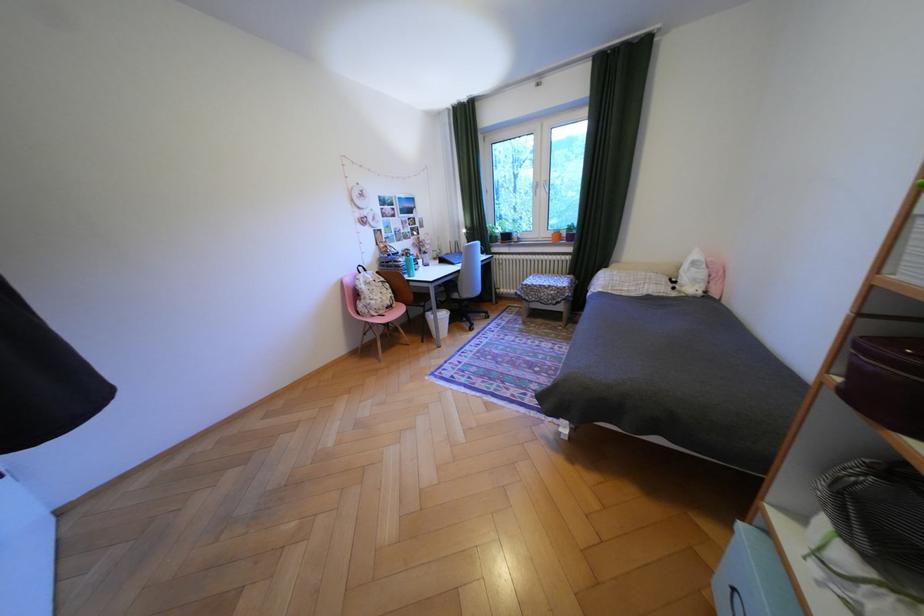
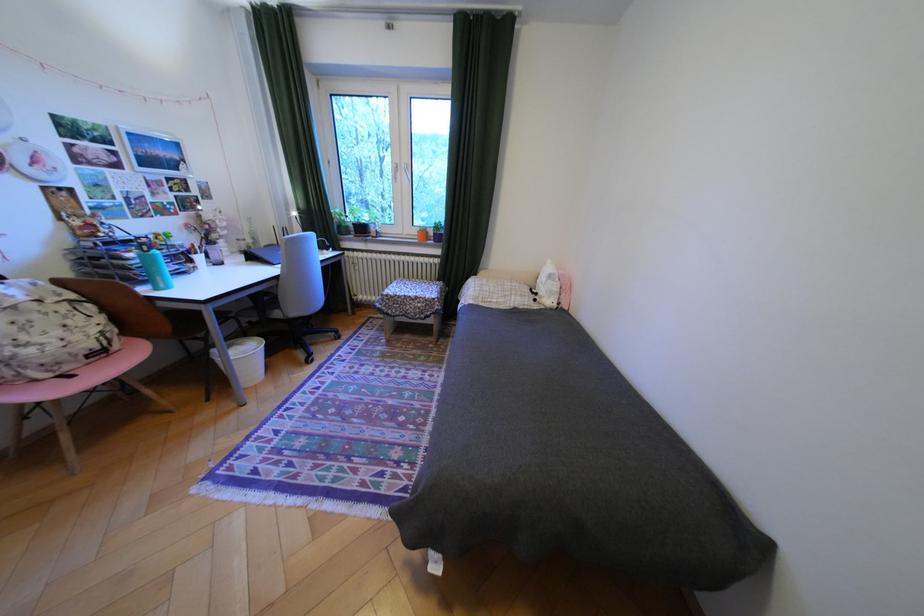
Where in the second image is the point corresponding to (562,233) from the first image?

(427, 232)